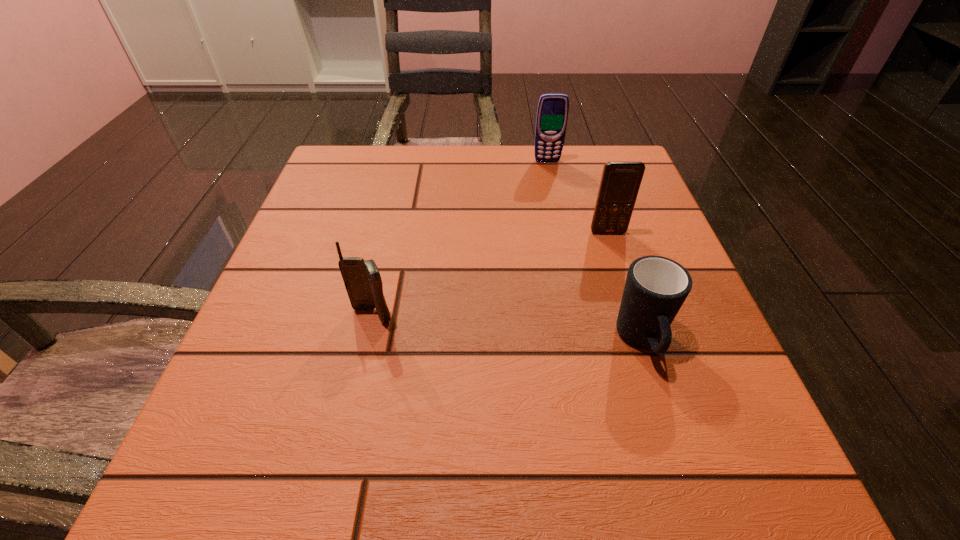
Identify the location of the farthest object. (552, 112).

Locate an element on the screen. the second cellular telephone from left to right is located at coordinates (552, 112).

Image resolution: width=960 pixels, height=540 pixels. I want to click on the second farthest cellular telephone, so click(620, 182).

Where is `the rightmost cellular telephone`? The width and height of the screenshot is (960, 540). the rightmost cellular telephone is located at coordinates (620, 182).

At what (x,y) coordinates should I click in order to perform the action: click on the leftmost object. Please return your answer as a coordinate pair (x, y). This screenshot has height=540, width=960. Looking at the image, I should click on (362, 279).

This screenshot has width=960, height=540. What are the coordinates of `the nearest cellular telephone` in the screenshot? It's located at (362, 279).

This screenshot has width=960, height=540. I want to click on mug, so click(x=656, y=287).

This screenshot has width=960, height=540. Find the location of `vacant space located on the front-facing side of the farthest object`. vacant space located on the front-facing side of the farthest object is located at coordinates (558, 214).

Locate an element on the screen. The width and height of the screenshot is (960, 540). free spot located 0.110m on the screen of the second nearest cellular telephone is located at coordinates (622, 275).

Where is `free region located 0.080m on the keyboard of the nearest cellular telephone`? free region located 0.080m on the keyboard of the nearest cellular telephone is located at coordinates (360, 369).